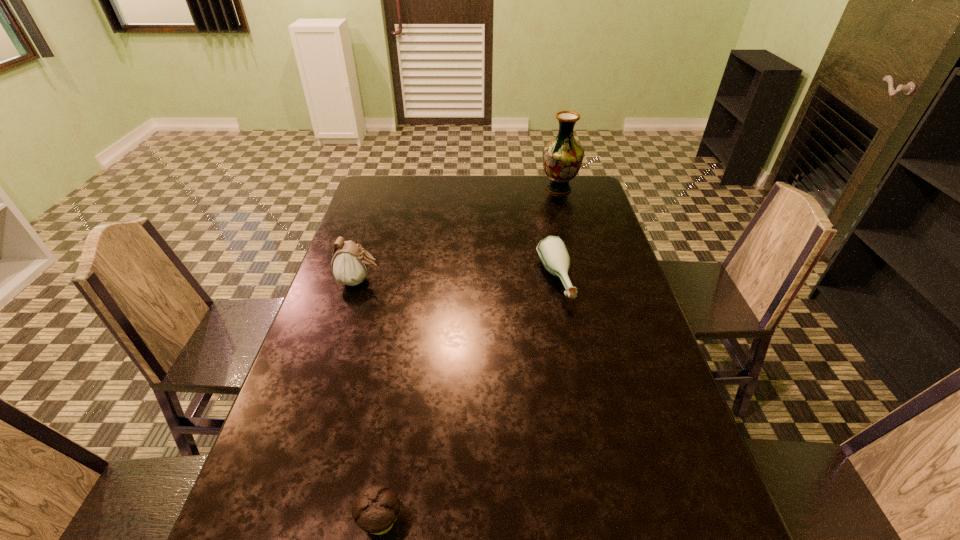
Find the location of a particular element. This screenshot has height=540, width=960. vase is located at coordinates (562, 157).

I want to click on the tallest object, so click(562, 157).

Where is `the leftmost object`? the leftmost object is located at coordinates (350, 263).

Locate an element on the screen. The width and height of the screenshot is (960, 540). the second tallest object is located at coordinates (350, 263).

At what (x,y) coordinates should I click in order to perform the action: click on bottle. Please return your answer as a coordinate pair (x, y). The image size is (960, 540). Looking at the image, I should click on (552, 250).

I want to click on free space located 0.250m on the left of the farthest object, so click(476, 188).

Find the location of a particular element. free region located 0.340m on the front-facing side of the pouch is located at coordinates (493, 281).

What are the coordinates of `vacant space located 0.350m on the front of the bottle` in the screenshot? It's located at (581, 418).

Identify the location of object located in the far edge section of the desktop. This screenshot has height=540, width=960. (562, 157).

Locate an element on the screen. object that is at the left edge is located at coordinates (350, 263).